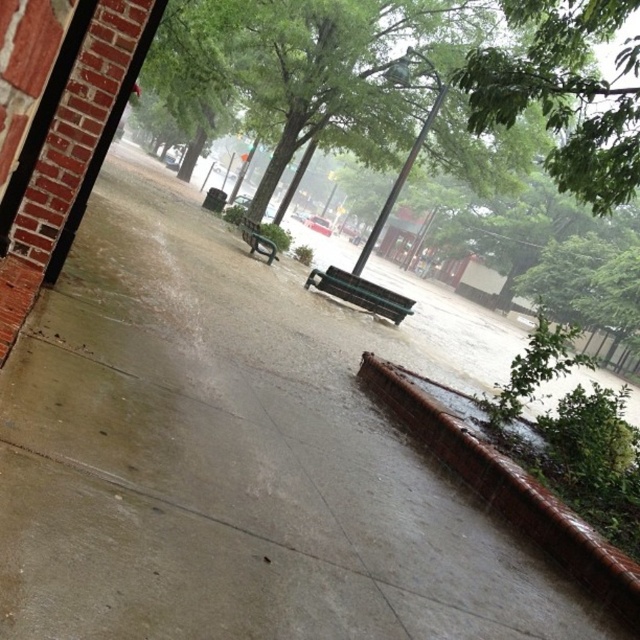
Consider the image. You are a delivery robot with a package that needs to be placed between the brown textured curb at lower right and the metallic green bench at center. Can you fit the package there if the package is 1.2 meters wide?

The brown textured curb at lower right is wider than the metallic green bench at center. However, the exact distance between them isn t specified in the provided description. Without knowing the space between the two objects, it s impossible to determine if the 1.2 meter wide package will fit. Please check the actual distance between the brown textured curb at lower right and the metallic green bench at center.

You are standing at the point labeled as point (506,486) in the image. What object is located at that point?

The point (506,486) indicates a brown textured curb at lower right.